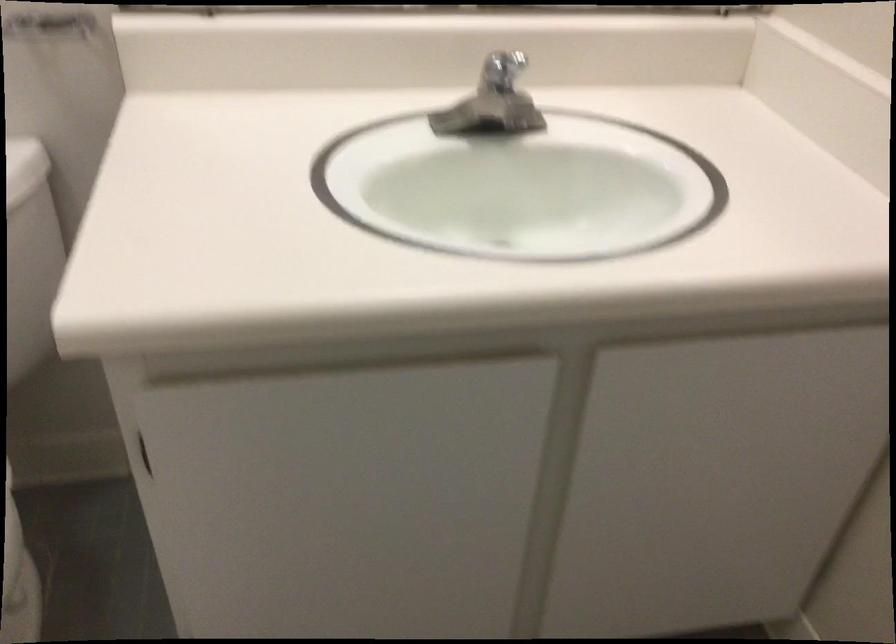
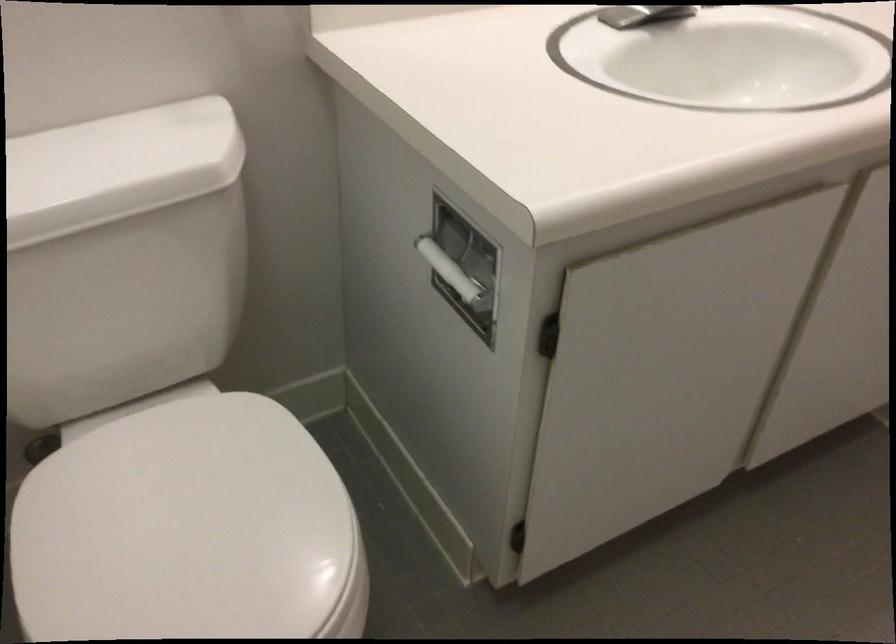
Question: The first image is from the beginning of the video and the second image is from the end. How did the camera likely rotate when shooting the video?

Choices:
 (A) Left
 (B) Right
 (C) Up
 (D) Down

Answer: (B)